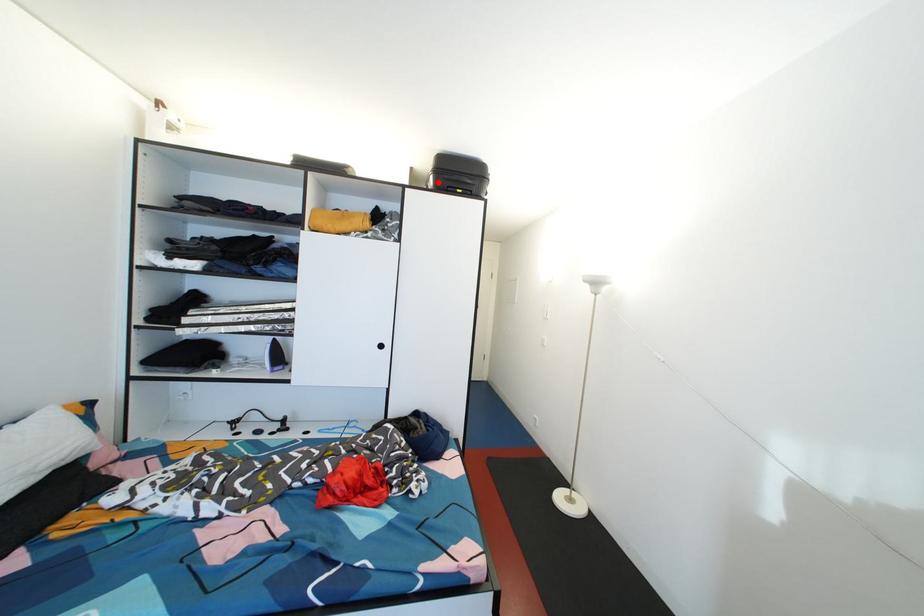
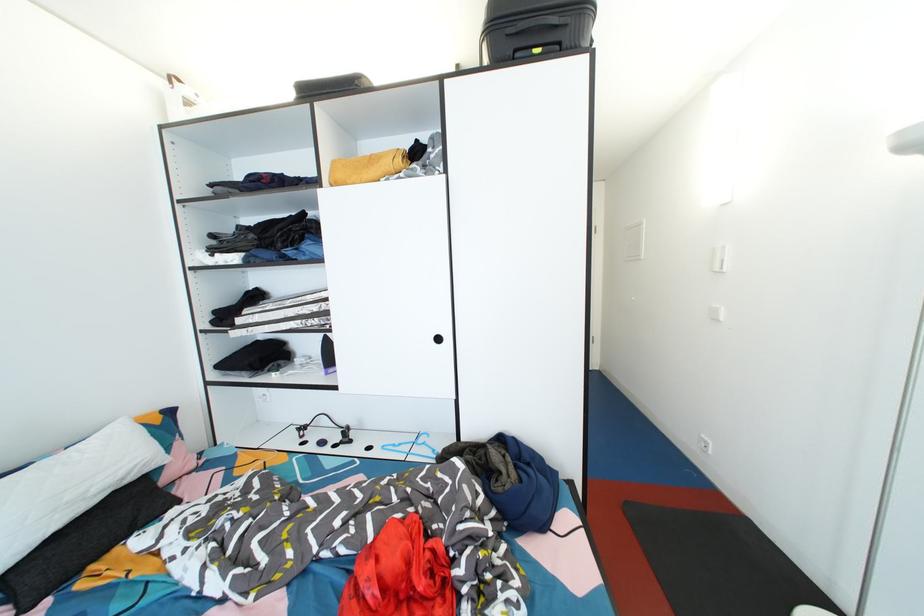
Where in the second image is the point corresponding to the highlighted location from the first image?

(492, 51)